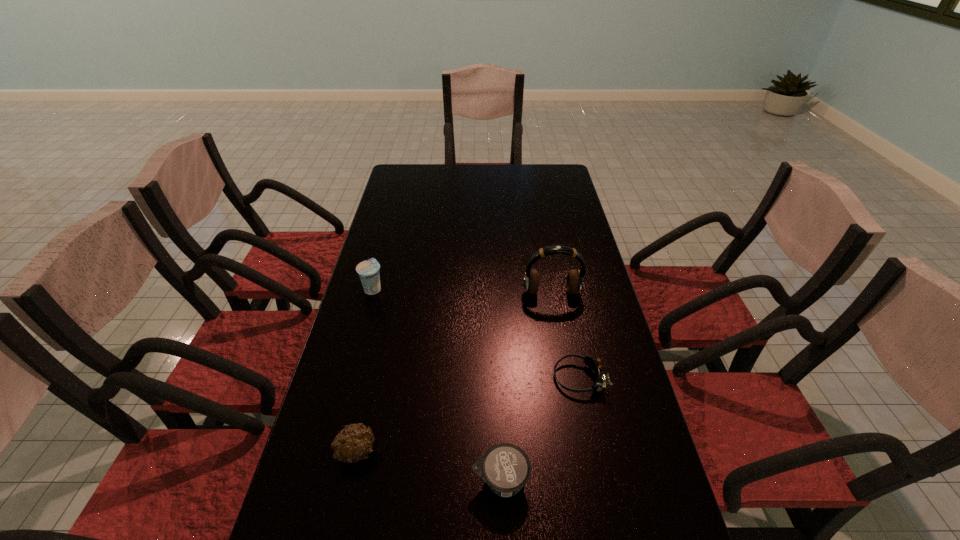
Find the location of a particular element. The image size is (960, 540). headset is located at coordinates (574, 282).

This screenshot has width=960, height=540. I want to click on the taller yogurt, so click(368, 270).

Where is `the fourth shortest object`? Image resolution: width=960 pixels, height=540 pixels. the fourth shortest object is located at coordinates (368, 270).

This screenshot has width=960, height=540. Identify the location of muffin. (352, 444).

I want to click on the shorter yogurt, so click(506, 468).

Where is `the nearer yogurt`? This screenshot has width=960, height=540. the nearer yogurt is located at coordinates (506, 468).

The height and width of the screenshot is (540, 960). Find the location of `the third farthest object`. the third farthest object is located at coordinates (595, 364).

The height and width of the screenshot is (540, 960). Identify the location of the shortest object. (595, 364).

Where is `vacant space located 0.130m on the ear cup of the tallest object`? Image resolution: width=960 pixels, height=540 pixels. vacant space located 0.130m on the ear cup of the tallest object is located at coordinates (559, 332).

Identify the location of free space located 0.060m on the front of the taller yogurt. (367, 312).